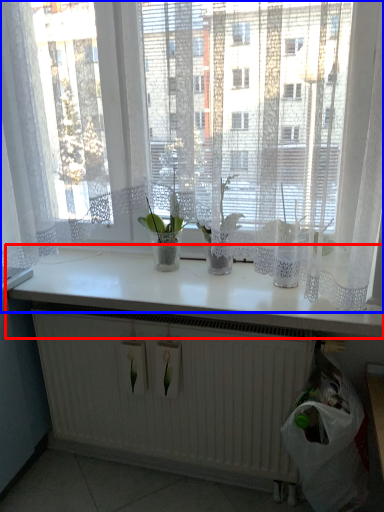
Question: Which point is further to the camera, counter top (highlighted by a red box) or curtain (highlighted by a blue box)?

Choices:
 (A) counter top
 (B) curtain

Answer: (A)